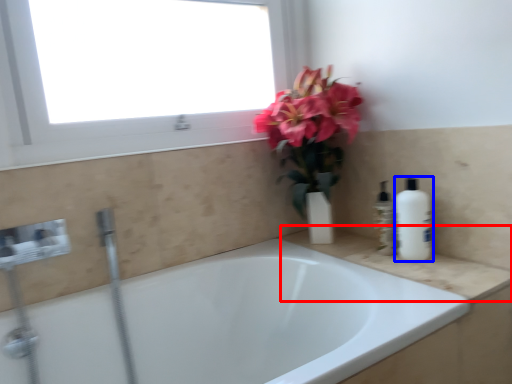
Question: Which point is further to the camera, counter top (highlighted by a red box) or cleaning product (highlighted by a blue box)?

Choices:
 (A) counter top
 (B) cleaning product

Answer: (B)